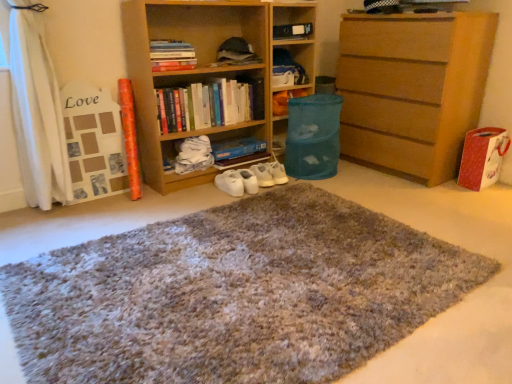
Question: Which direction should I rotate to look at hardcover book at upper center, arranged as the 1th book when viewed from the top?

Choices:
 (A) left
 (B) right

Answer: (A)

Question: From the image's perspective, does blue fabric bean bag chair at center appear lower than shaggy carpet at center?

Choices:
 (A) yes
 (B) no

Answer: (B)

Question: Is blue fabric bean bag chair at center looking in the opposite direction of shaggy carpet at center?

Choices:
 (A) no
 (B) yes

Answer: (A)

Question: Is blue fabric bean bag chair at center thinner than shaggy carpet at center?

Choices:
 (A) no
 (B) yes

Answer: (B)

Question: Is blue fabric bean bag chair at center outside of shaggy carpet at center?

Choices:
 (A) no
 (B) yes

Answer: (B)

Question: Could shaggy carpet at center be considered to be inside blue fabric bean bag chair at center?

Choices:
 (A) yes
 (B) no

Answer: (B)

Question: Does blue fabric bean bag chair at center appear on the right side of shaggy carpet at center?

Choices:
 (A) yes
 (B) no

Answer: (A)

Question: Is white matte sneakers at center looking in the opposite direction of hardcover books at center, which is the first book from bottom to top?

Choices:
 (A) yes
 (B) no

Answer: (B)

Question: From the image's perspective, does white matte sneakers at center appear higher than hardcover books at center, which is the first book from bottom to top?

Choices:
 (A) yes
 (B) no

Answer: (B)

Question: Does white matte sneakers at center turn towards hardcover books at center, which is the first book from bottom to top?

Choices:
 (A) no
 (B) yes

Answer: (A)

Question: Is the depth of white matte sneakers at center less than that of hardcover books at center, which is the first book from bottom to top?

Choices:
 (A) yes
 (B) no

Answer: (B)

Question: Considering the relative sizes of white matte sneakers at center and hardcover books at center, which is the first book from bottom to top, in the image provided, is white matte sneakers at center thinner than hardcover books at center, which is the first book from bottom to top,?

Choices:
 (A) yes
 (B) no

Answer: (B)

Question: From the image's perspective, does white matte sneakers at center appear lower than hardcover books at center, which is the first book from bottom to top?

Choices:
 (A) yes
 (B) no

Answer: (A)

Question: Is wooden bookshelf at center not near translucent plastic bin at center?

Choices:
 (A) no
 (B) yes

Answer: (A)